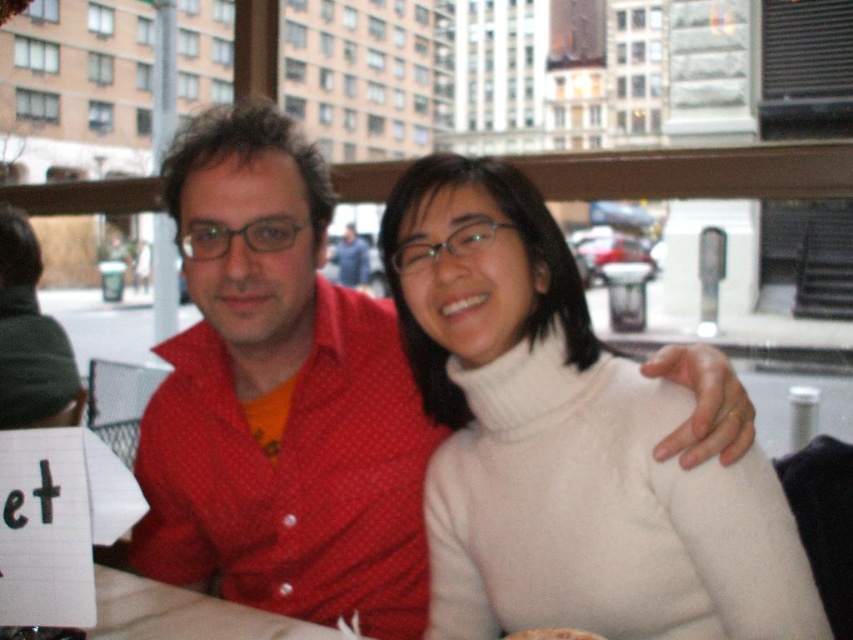
You are a photographer trying to capture a closeup of the brown crumbly bread at center without the red dotted shirt at center blocking the view. Can you adjust your angle to do so?

The red dotted shirt at center is located above the brown crumbly bread at center, so you can lower your camera angle to avoid the shirt blocking the view of the bread.

You are a fashion designer observing two people at a city cafe. You notice the white wool sweater at center and the red dotted shirt at center. Which clothing item is located to the right of the other?

The white wool sweater at center is positioned on the right side of the red dotted shirt at center.

In the scene shown: You are a food delivery person who needs to place a small container of hot soup between the white wool sweater at center and the brown crumbly bread at center on the table. Considering the space between them, will the container fit?

The white wool sweater at center is wider than the brown crumbly bread at center. Therefore, the space between them may be insufficient for the small container of hot soup unless the sweater is moved. Please check the exact dimensions or adjust the placement.